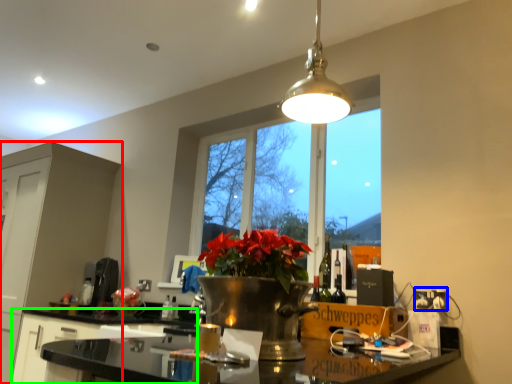
Question: Based on their relative distances, which object is nearer to cabinetry (highlighted by a red box)? Choose from electric outlet (highlighted by a blue box) and cabinetry (highlighted by a green box).

Choices:
 (A) electric outlet
 (B) cabinetry

Answer: (B)